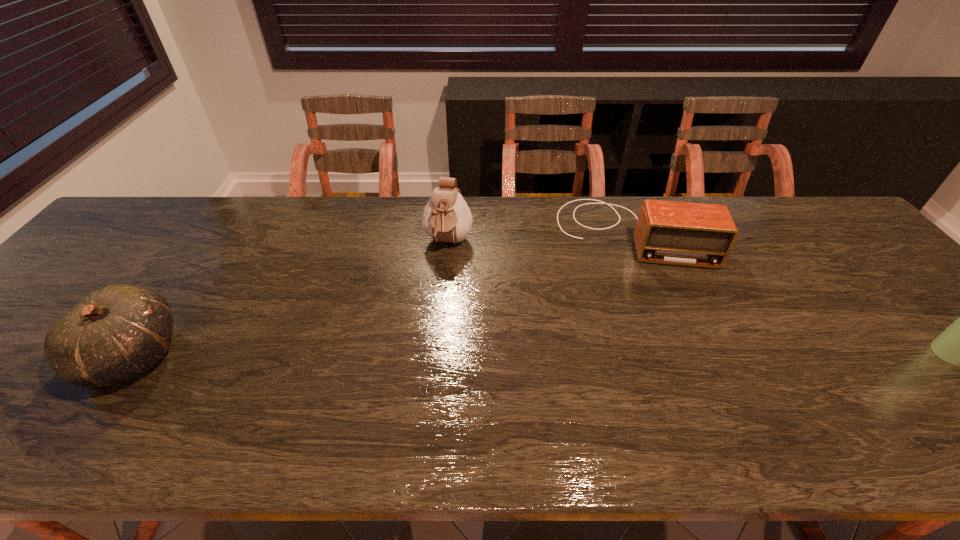
At what (x,y) coordinates should I click in order to perform the action: click on gourd. Please return your answer as a coordinate pair (x, y). Looking at the image, I should click on (116, 333).

This screenshot has width=960, height=540. I want to click on pouch, so click(x=446, y=218).

Where is `the third object from left to right`? the third object from left to right is located at coordinates (667, 232).

Where is `the shortest object`? The height and width of the screenshot is (540, 960). the shortest object is located at coordinates (667, 232).

The image size is (960, 540). Identify the location of vacant space located 0.380m on the back of the gourd. (225, 222).

This screenshot has width=960, height=540. I want to click on free space located 0.230m on the front-facing side of the second object from left to right, so click(x=431, y=325).

Locate an element on the screen. This screenshot has width=960, height=540. free space located 0.180m on the front-facing side of the second object from left to right is located at coordinates (434, 310).

Where is `vacant space situated 0.180m on the front-facing side of the second object from left to right`? This screenshot has height=540, width=960. vacant space situated 0.180m on the front-facing side of the second object from left to right is located at coordinates (434, 310).

At what (x,y) coordinates should I click in order to perform the action: click on blank area located on the front-facing side of the radio receiver. Please return your answer as a coordinate pair (x, y). The width and height of the screenshot is (960, 540). Looking at the image, I should click on click(656, 380).

Find the location of a particular element. This screenshot has height=540, width=960. vacant space located 0.360m on the front-facing side of the radio receiver is located at coordinates (656, 384).